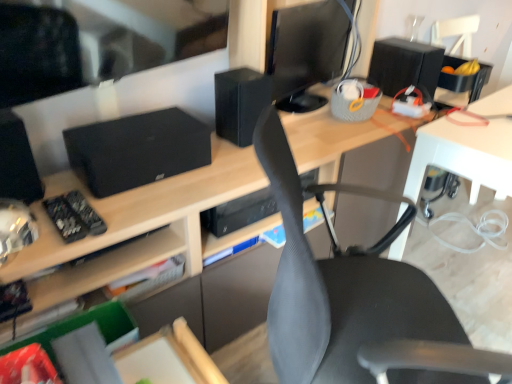
Question: Is black matte speaker at upper center, which is the 2th speaker from right to left, smaller than black matte speaker at left, the 3th speaker viewed from the back?

Choices:
 (A) yes
 (B) no

Answer: (B)

Question: From a real-world perspective, is black matte speaker at upper center, which is the 2th speaker from right to left, positioned over black matte speaker at left, the 3th speaker positioned from the right, based on gravity?

Choices:
 (A) no
 (B) yes

Answer: (A)

Question: Is black matte speaker at upper center, which is the 2th speaker from right to left, far from black matte speaker at left, placed as the first speaker when sorted from front to back?

Choices:
 (A) no
 (B) yes

Answer: (A)

Question: From the image's perspective, does black matte speaker at upper center, placed as the second speaker when sorted from left to right, appear higher than black matte speaker at left, which appears as the 1th speaker when viewed from the left?

Choices:
 (A) no
 (B) yes

Answer: (B)

Question: Is black matte speaker at upper center, placed as the second speaker when sorted from left to right, bigger than black matte speaker at left, placed as the first speaker when sorted from front to back?

Choices:
 (A) yes
 (B) no

Answer: (A)

Question: Considering their positions, is gray mesh chair at center located in front of or behind black matte remote control at left?

Choices:
 (A) behind
 (B) front

Answer: (B)

Question: From a real-world perspective, is gray mesh chair at center above or below black matte remote control at left?

Choices:
 (A) below
 (B) above

Answer: (A)

Question: From their relative heights in the image, would you say gray mesh chair at center is taller or shorter than black matte remote control at left?

Choices:
 (A) tall
 (B) short

Answer: (A)

Question: Considering the relative positions of gray mesh chair at center and black matte remote control at left in the image provided, is gray mesh chair at center to the left or to the right of black matte remote control at left?

Choices:
 (A) right
 (B) left

Answer: (A)

Question: From their relative heights in the image, would you say matte wood desk at center is taller or shorter than black matte speaker at upper center, which ranks as the second speaker in back-to-front order?

Choices:
 (A) short
 (B) tall

Answer: (B)

Question: From a real-world perspective, relative to black matte speaker at upper center, marked as the second speaker in a front-to-back arrangement, is matte wood desk at center vertically above or below?

Choices:
 (A) below
 (B) above

Answer: (A)

Question: From the image's perspective, is matte wood desk at center positioned above or below black matte speaker at upper center, which is the 2th speaker from right to left?

Choices:
 (A) below
 (B) above

Answer: (A)

Question: Looking at their shapes, would you say matte wood desk at center is wider or thinner than black matte speaker at upper center, which ranks as the second speaker in back-to-front order?

Choices:
 (A) wide
 (B) thin

Answer: (A)

Question: Is black matte speaker at upper center, which ranks as the second speaker in back-to-front order, bigger or smaller than black glossy monitor at upper center?

Choices:
 (A) small
 (B) big

Answer: (A)

Question: From the image's perspective, relative to black glossy monitor at upper center, is black matte speaker at upper center, which is the 2th speaker from right to left, above or below?

Choices:
 (A) above
 (B) below

Answer: (B)